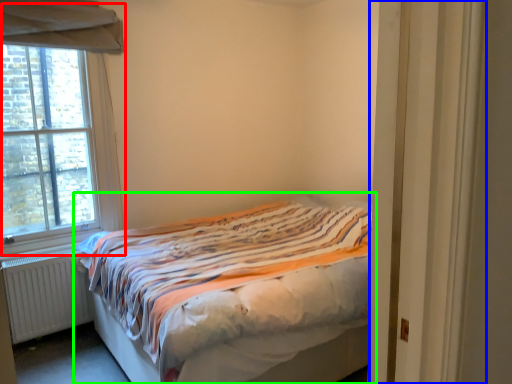
Question: Which object is the closest to the window (highlighted by a red box)? Choose among these: door (highlighted by a blue box) or bed (highlighted by a green box).

Choices:
 (A) door
 (B) bed

Answer: (B)